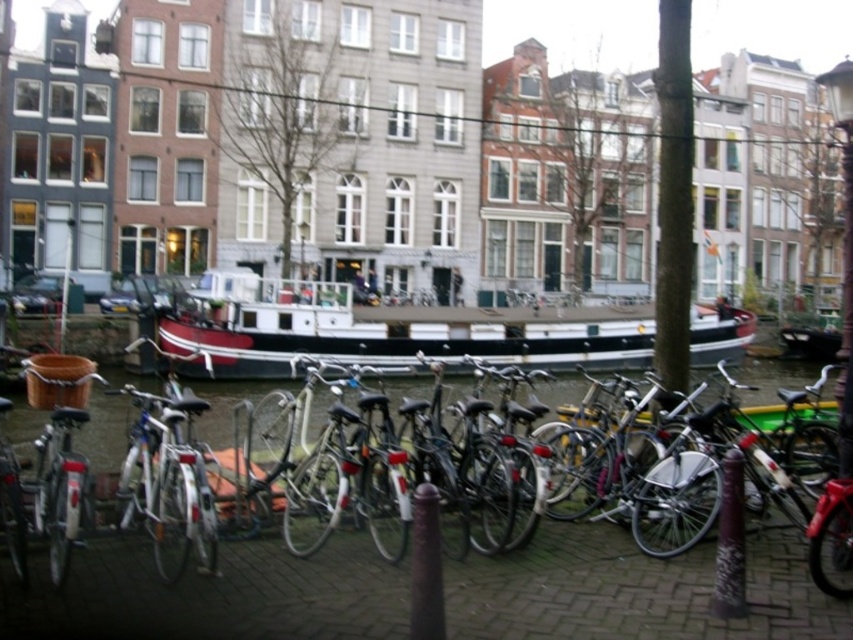
Can you confirm if white glossy boat at center is positioned below shiny silver bicycle at center?

No, white glossy boat at center is not below shiny silver bicycle at center.

Does point (215, 337) come behind point (544, 554)?

Yes.

Identify the location of white glossy boat at center. This screenshot has height=640, width=853. (389, 332).